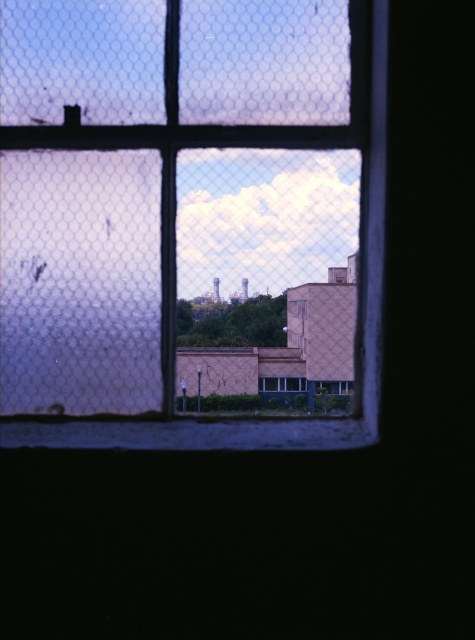
You are an interior designer planning to install a new window in a room. You have two options from the image provided. Which window option, the clear glass window at center or the blue glass window at center, would allow more natural light into the room based on their sizes?

The clear glass window at center has a larger size compared to the blue glass window at center, so it would allow more natural light into the room.

You are a window installer working on a project where you need to install a new window that is 12 inches wide. You have two existing windows in the frame, the clear glass window at center and the blue glass window at center. Can you fit the new window between them without overlapping?

The clear glass window at center and blue glass window at center are 11.64 inches apart from each other. Since the new window is 12 inches wide, it would not fit between them as the space is slightly smaller than the window.